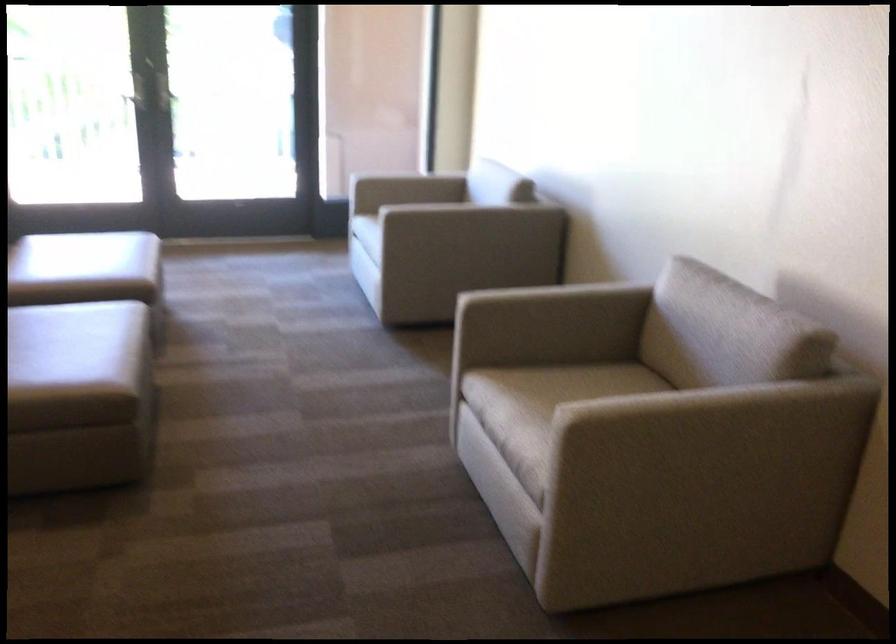
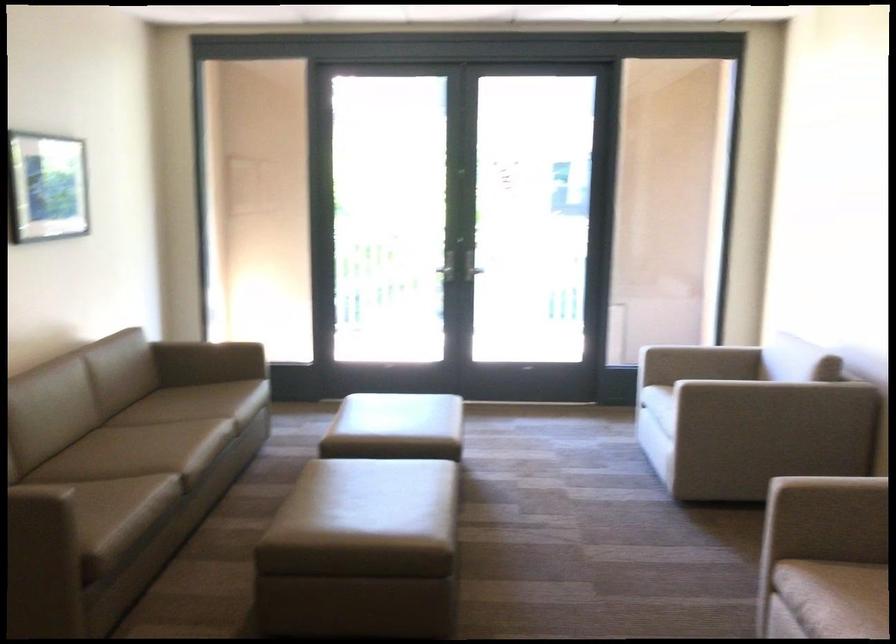
Where in the second image is the point corresponding to (127,93) from the first image?

(444, 270)